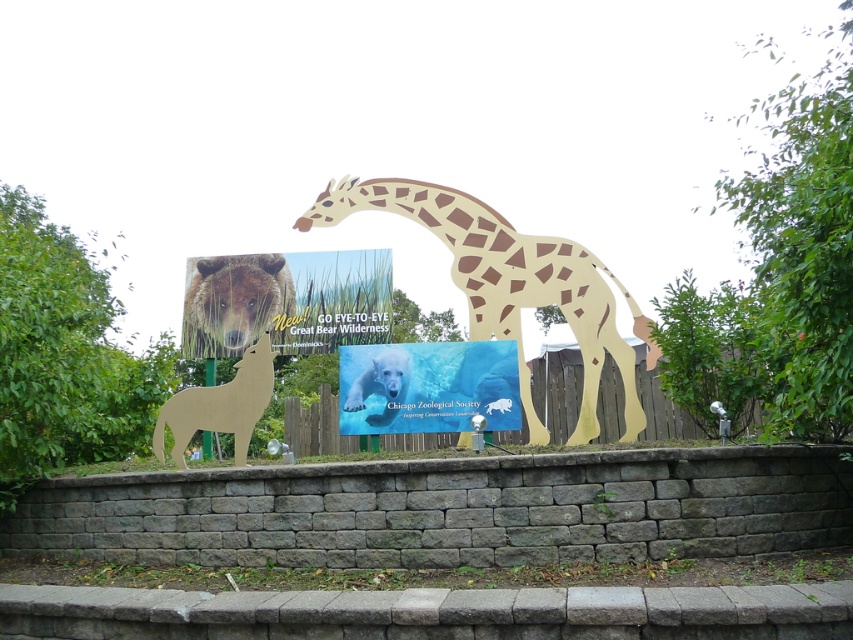
Question: Is brown fur bear at upper left above wooden wolf at lower left?

Choices:
 (A) yes
 (B) no

Answer: (A)

Question: Which point is farther to the camera?

Choices:
 (A) brown fur bear at upper left
 (B) wooden giraffe at center

Answer: (A)

Question: Which object is the farthest from the blue glossy polar bear at center?

Choices:
 (A) white glossy polar bear at center
 (B) wooden wolf at lower left
 (C) wooden giraffe at center

Answer: (B)

Question: Considering the relative positions of wooden giraffe at center and brown fur bear at upper left in the image provided, where is wooden giraffe at center located with respect to brown fur bear at upper left?

Choices:
 (A) left
 (B) right

Answer: (B)

Question: Is wooden giraffe at center to the right of white glossy polar bear at center from the viewer's perspective?

Choices:
 (A) no
 (B) yes

Answer: (B)

Question: Which object appears closest to the camera in this image?

Choices:
 (A) blue glossy polar bear at center
 (B) wooden wolf at lower left
 (C) brown fur bear at upper left
 (D) wooden giraffe at center

Answer: (B)